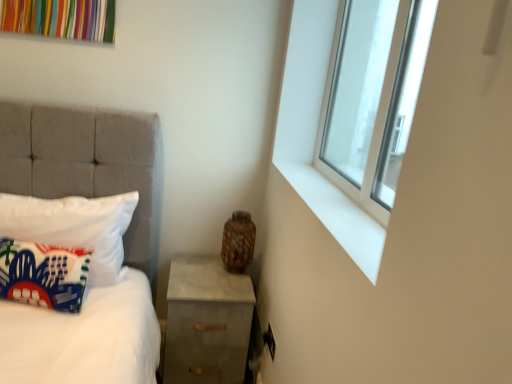
At what (x,y) coordinates should I click in order to perform the action: click on vacant area that is in front of brown textured vase at lower right. Please return your answer as a coordinate pair (x, y). Looking at the image, I should click on (224, 283).